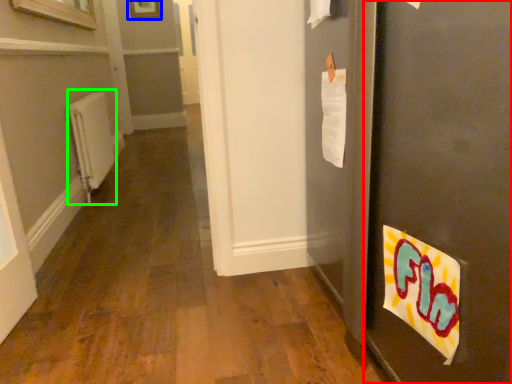
Question: Considering the real-world distances, which object is farthest from door (highlighted by a red box)? picture frame (highlighted by a blue box) or radiator (highlighted by a green box)?

Choices:
 (A) picture frame
 (B) radiator

Answer: (A)